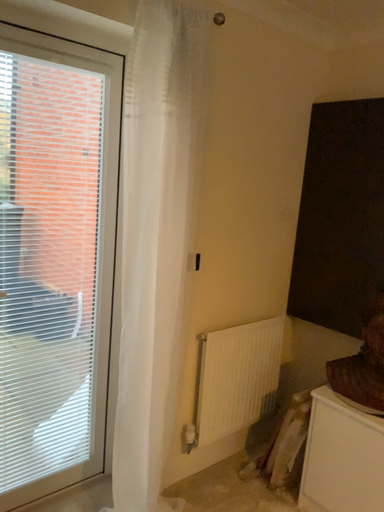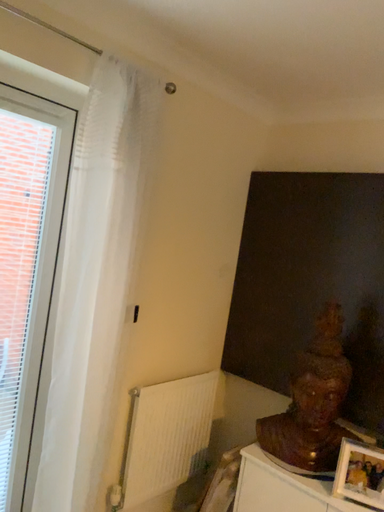
Question: How did the camera likely rotate when shooting the video?

Choices:
 (A) rotated left
 (B) rotated right

Answer: (B)